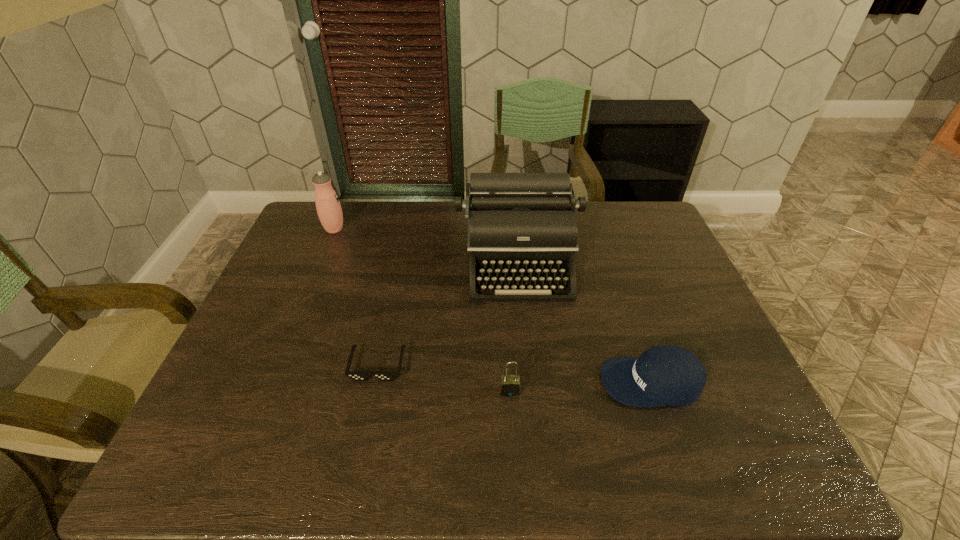
The width and height of the screenshot is (960, 540). I want to click on vacant space at the left edge of the desktop, so click(x=244, y=375).

Locate an element on the screen. free location at the right edge is located at coordinates (677, 294).

Where is `free space at the near left corner of the desktop`? free space at the near left corner of the desktop is located at coordinates (188, 469).

In the image, there is a desktop. Where is `vacant space at the far right corner`? vacant space at the far right corner is located at coordinates (652, 208).

The height and width of the screenshot is (540, 960). In order to click on unoccupied position between the typewriter and the third shortest object in this screenshot , I will do `click(515, 326)`.

Locate an element on the screen. This screenshot has height=540, width=960. empty space between the thermos bottle and the typewriter is located at coordinates (427, 245).

The height and width of the screenshot is (540, 960). I want to click on vacant region between the typewriter and the padlock, so click(x=515, y=326).

Locate an element on the screen. This screenshot has height=540, width=960. free space between the shortest object and the leftmost object is located at coordinates (356, 297).

This screenshot has height=540, width=960. In order to click on vacant space in between the leftmost object and the padlock in this screenshot , I will do `click(422, 310)`.

What are the coordinates of `vacant region between the sunglasses and the baseball cap` in the screenshot? It's located at (515, 373).